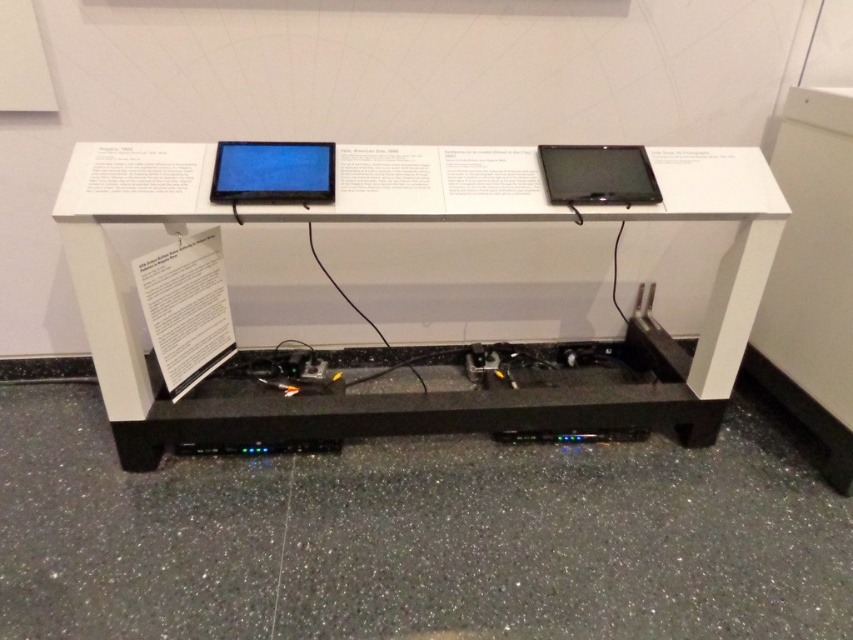
You are a technician who needs to access both the white matte table at center and the matte black laptop at center. Which one will you reach first if you approach from the front?

You will reach the white matte table at center first because it is closer to you than the matte black laptop at center.

You are a technician adjusting the cables on the stand. You notice two points marked on the stand at coordinates point (341,412) and point (265,177). Which point is closer to your current position as you work on the stand?

Point (265,177) is closer to your current position because it is less further to the camera than point (341,412), which is further away.

You are setting up a presentation and need to place a laptop and a table in a specific arrangement. According to the scene, where should the white matte table at center be placed relative to the matte black laptop at upper right?

The white matte table at center is positioned on the left side of the matte black laptop at upper right, so you should place the white matte table at center to the left of the matte black laptop at upper right.